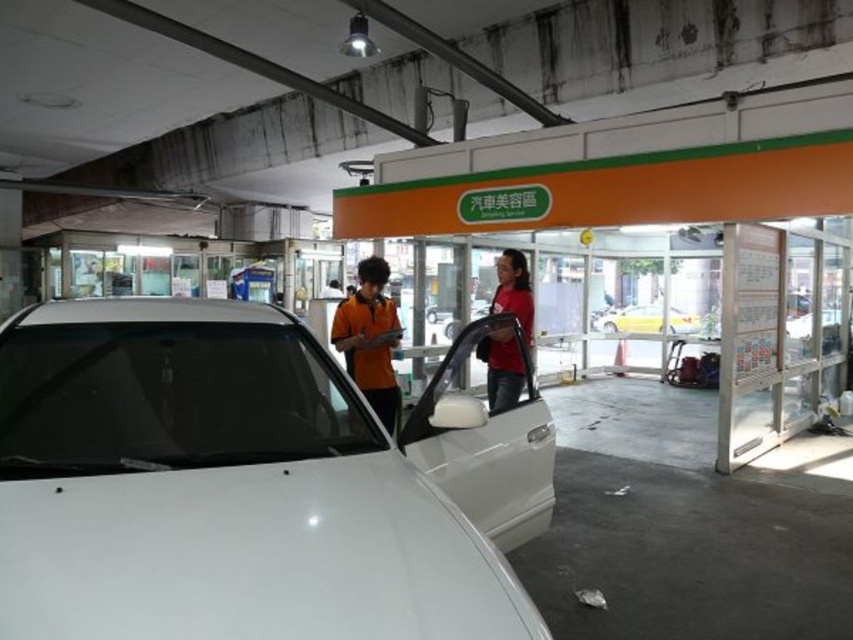
Does white glossy car at center have a lesser height compared to orange matte shirt at center?

Yes, white glossy car at center is shorter than orange matte shirt at center.

Between white glossy car at center and orange matte shirt at center, which one has more height?

orange matte shirt at center

Which is behind, point (67, 632) or point (376, 360)?

The point (376, 360) is more distant.

What are the coordinates of `white glossy car at center` in the screenshot? It's located at (219, 488).

Is point (380, 355) positioned behind point (677, 332)?

No, (380, 355) is in front of (677, 332).

Between point (392, 332) and point (642, 321), which one is positioned in front?

Point (392, 332)

This screenshot has width=853, height=640. I want to click on orange matte shirt at center, so (x=370, y=339).

Is white glossy car at center positioned in front of white matte car at center?

Yes, white glossy car at center is closer to the viewer.

Who is lower down, white glossy car at center or white matte car at center?

Positioned lower is white glossy car at center.

Which is in front, point (415, 586) or point (474, 317)?

Point (415, 586)

Where is `white glossy car at center`? The width and height of the screenshot is (853, 640). white glossy car at center is located at coordinates (219, 488).